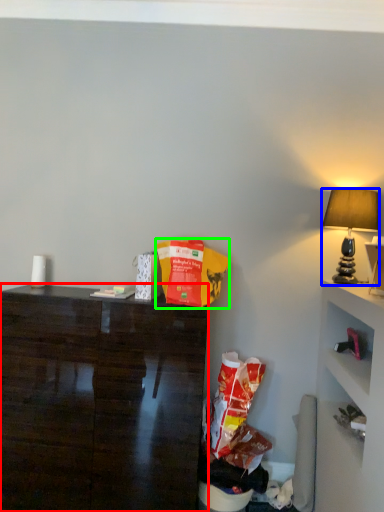
Question: Based on their relative distances, which object is farther from desk (highlighted by a red box)? Choose from lamp (highlighted by a blue box) and paper bag (highlighted by a green box).

Choices:
 (A) lamp
 (B) paper bag

Answer: (A)